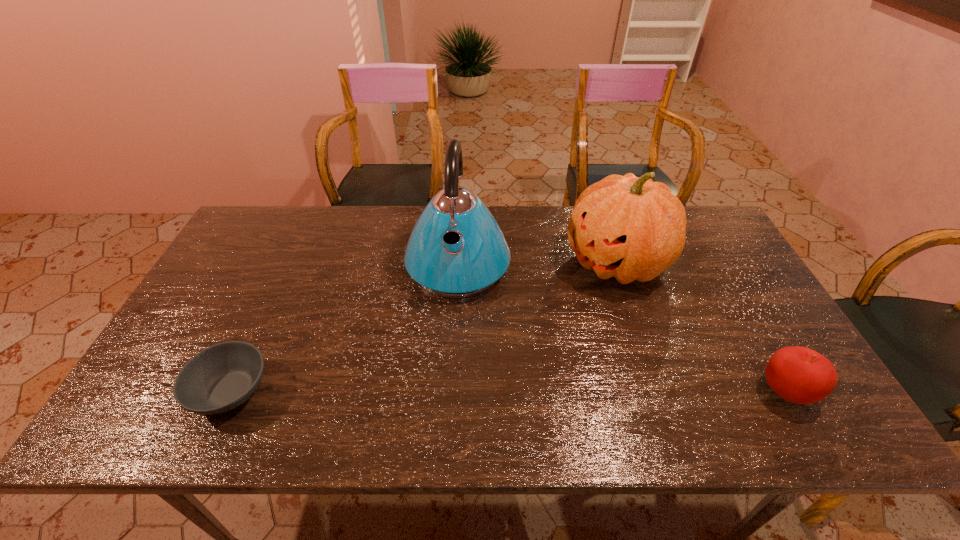
Identify which object is located as the second nearest to the rightmost object. Please provide its 2D coordinates. Your answer should be formatted as a tuple, i.e. [(x, y)], where the tuple contains the x and y coordinates of a point satisfying the conditions above.

[(456, 249)]

Locate which object ranks third in proximity to the pumpkin. Please provide its 2D coordinates. Your answer should be formatted as a tuple, i.e. [(x, y)], where the tuple contains the x and y coordinates of a point satisfying the conditions above.

[(222, 377)]

Find the location of a particular element. free region that satisfies the following two spatial constraints: 1. on the back side of the shortest object; 2. on the left side of the pumpkin is located at coordinates (290, 263).

This screenshot has height=540, width=960. I want to click on free space that satisfies the following two spatial constraints: 1. on the front side of the rightmost object; 2. on the left side of the pumpkin, so tap(659, 392).